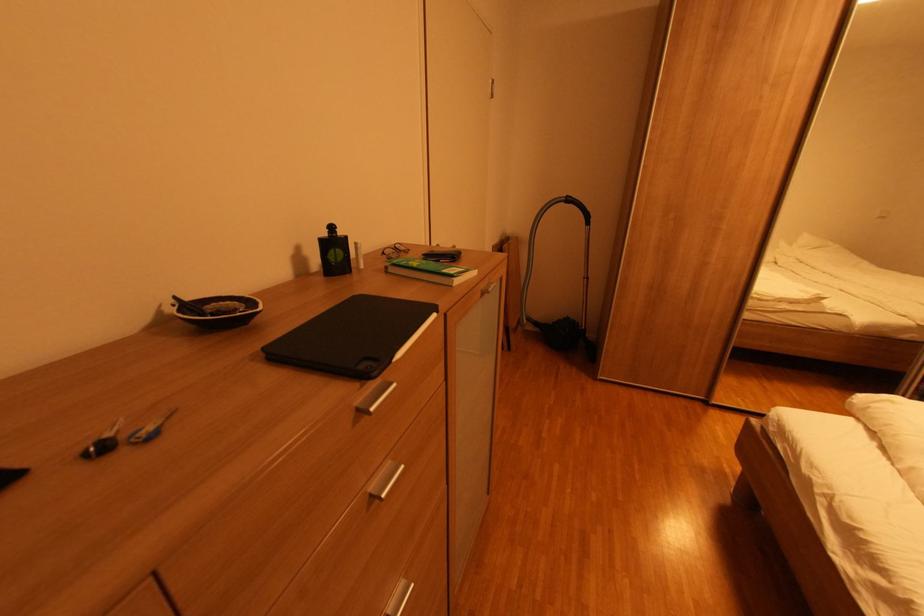
The width and height of the screenshot is (924, 616). What do you see at coordinates (580, 209) in the screenshot? I see `the vacuum cleaner handle` at bounding box center [580, 209].